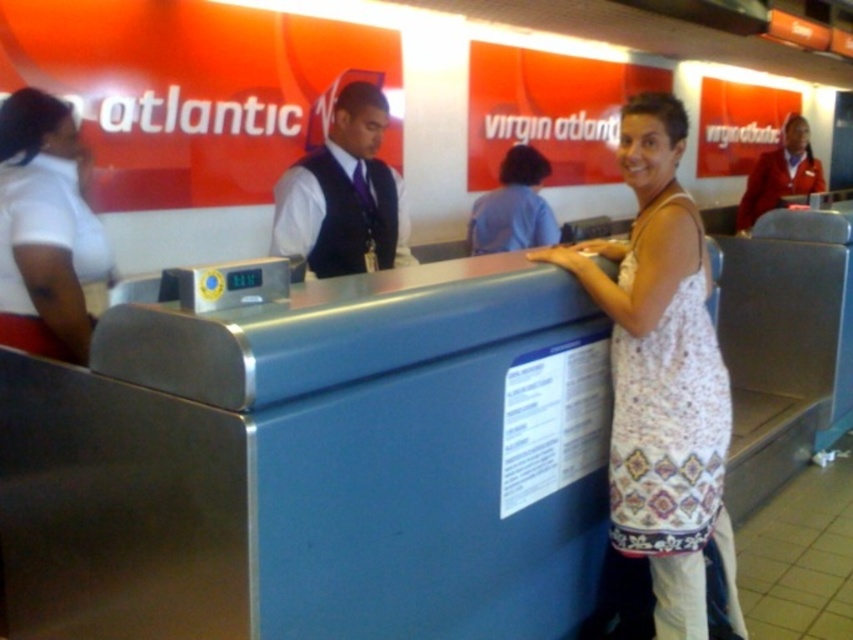
Between white matte shirt at left and blue fabric shirt at center, which one has less height?

blue fabric shirt at center

Can you confirm if white matte shirt at left is positioned above blue fabric shirt at center?

No, white matte shirt at left is not above blue fabric shirt at center.

What do you see at coordinates (45, 228) in the screenshot? I see `white matte shirt at left` at bounding box center [45, 228].

Find the location of a particular element. The width and height of the screenshot is (853, 640). white matte shirt at left is located at coordinates (45, 228).

Can you confirm if white printed dress at center is shorter than blue fabric shirt at center?

In fact, white printed dress at center may be taller than blue fabric shirt at center.

Who is shorter, white printed dress at center or blue fabric shirt at center?

blue fabric shirt at center is shorter.

Locate an element on the screen. The height and width of the screenshot is (640, 853). white printed dress at center is located at coordinates (662, 376).

In the scene shown: Can you confirm if white printed dress at center is positioned below red velvet uniform at upper right?

Yes, white printed dress at center is below red velvet uniform at upper right.

How much distance is there between white printed dress at center and red velvet uniform at upper right?

A distance of 3.87 meters exists between white printed dress at center and red velvet uniform at upper right.

Is point (677, 164) positioned behind point (752, 224)?

No, it is not.

I want to click on white printed dress at center, so (662, 376).